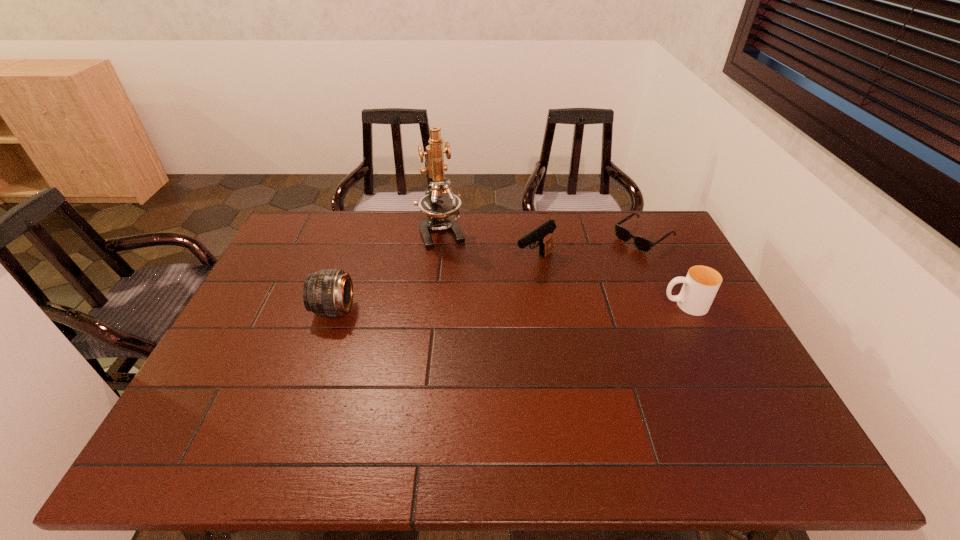
At what (x,y) coordinates should I click in order to perform the action: click on the leftmost object. Please return your answer as a coordinate pair (x, y). The height and width of the screenshot is (540, 960). Looking at the image, I should click on (329, 292).

Locate an element on the screen. the fourth tallest object is located at coordinates [x=701, y=284].

The image size is (960, 540). Identify the location of the shortest object. (642, 244).

Identify the location of the third object from left to right. Image resolution: width=960 pixels, height=540 pixels. (543, 234).

Find the location of a particular element. the fourth object from right to left is located at coordinates (437, 205).

Image resolution: width=960 pixels, height=540 pixels. In order to click on microscope in this screenshot , I will do `click(437, 205)`.

This screenshot has height=540, width=960. What are the coordinates of `vacant area located at the front element of the telephoto lens` in the screenshot? It's located at (263, 309).

Locate an element on the screen. The width and height of the screenshot is (960, 540). vacant position located 0.200m at the front element of the telephoto lens is located at coordinates (246, 309).

You are a GUI agent. You are given a task and a screenshot of the screen. Output one action in this format:
    pyautogui.click(x=<x>, y=<y>)
    Task: Click on the free space located 0.180m at the front element of the telephoto lens
    The height and width of the screenshot is (540, 960).
    Given the screenshot: What is the action you would take?
    pyautogui.click(x=252, y=309)

Find the location of `vacant space located with the handle on the side of the fourth tallest object`. vacant space located with the handle on the side of the fourth tallest object is located at coordinates (564, 305).